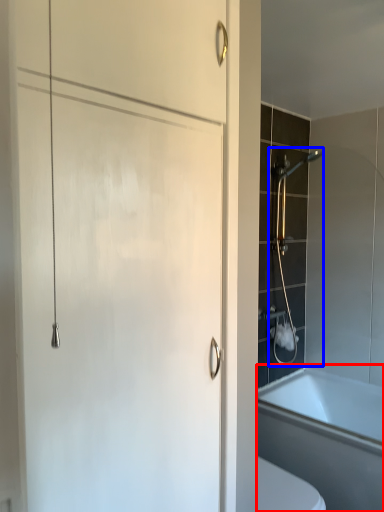
Question: Which object is further to the camera taking this photo, bathtub (highlighted by a red box) or shower (highlighted by a blue box)?

Choices:
 (A) bathtub
 (B) shower

Answer: (B)